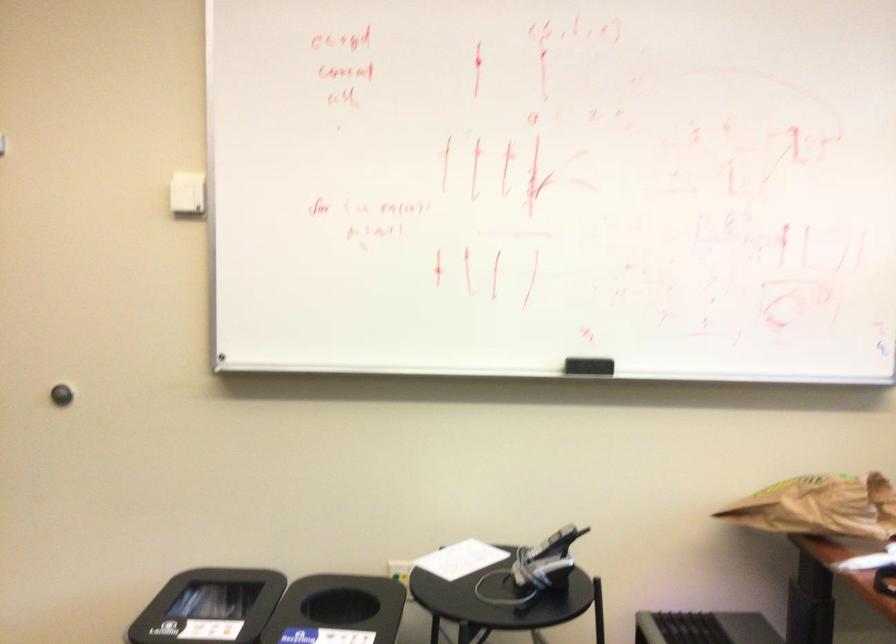
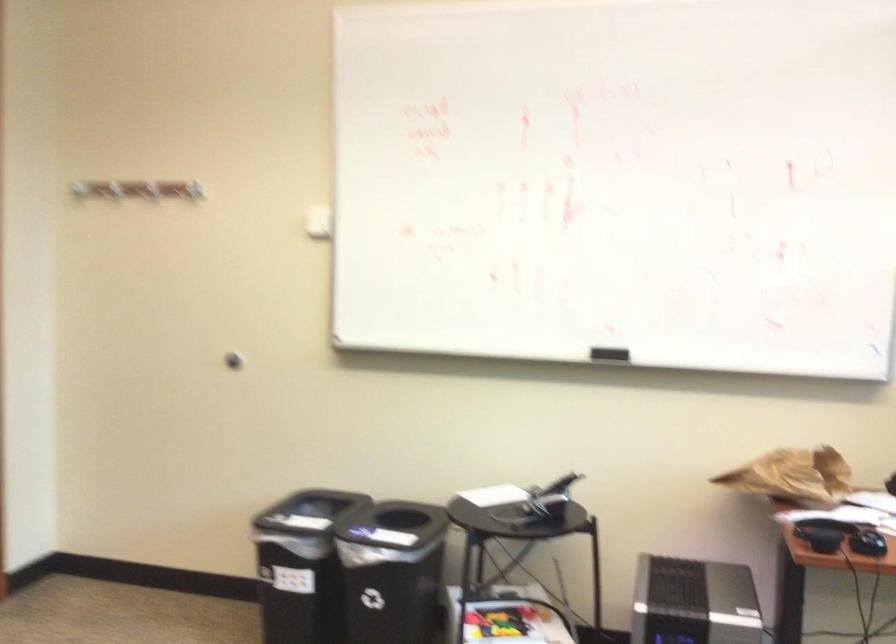
Question: The camera is either moving clockwise (left) or counter-clockwise (right) around the object. The first image is from the beginning of the video and the second image is from the end. Is the camera moving left or right when shooting the video?

Choices:
 (A) Left
 (B) Right

Answer: (B)